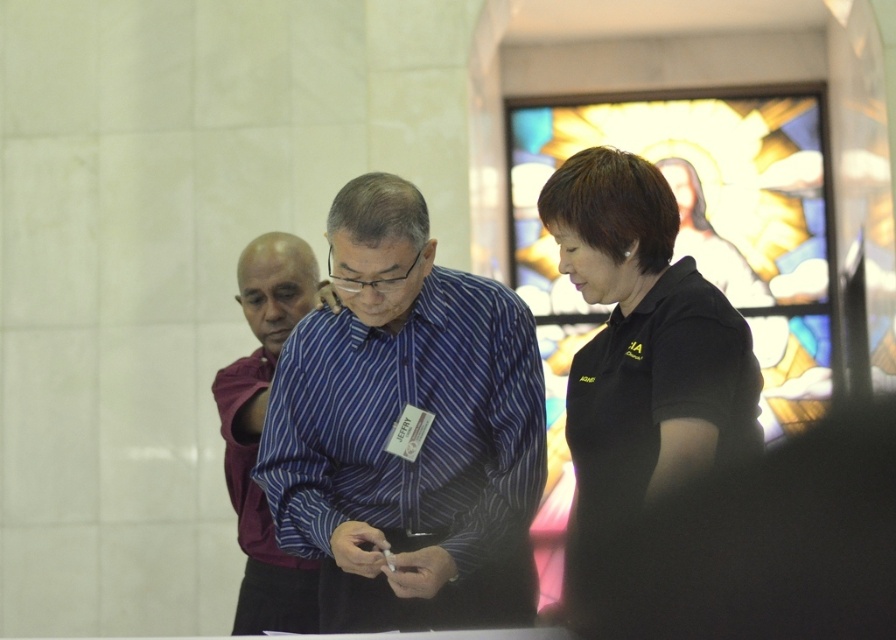
Question: Is the position of black matte shirt at center less distant than that of maroon fabric shirt at left?

Choices:
 (A) yes
 (B) no

Answer: (A)

Question: Which of the following is the farthest from the observer?

Choices:
 (A) blue striped shirt at center
 (B) black matte shirt at center
 (C) stained glass at upper right

Answer: (A)

Question: Which point is closer to the camera taking this photo?

Choices:
 (A) (390, 524)
 (B) (677, 173)

Answer: (A)

Question: Which of the following is the farthest from the observer?

Choices:
 (A) stained glass at upper right
 (B) blue striped shirt at center

Answer: (B)

Question: Is stained glass at upper right wider than maroon fabric shirt at left?

Choices:
 (A) yes
 (B) no

Answer: (A)

Question: Is blue striped shirt at center behind maroon fabric shirt at left?

Choices:
 (A) no
 (B) yes

Answer: (A)